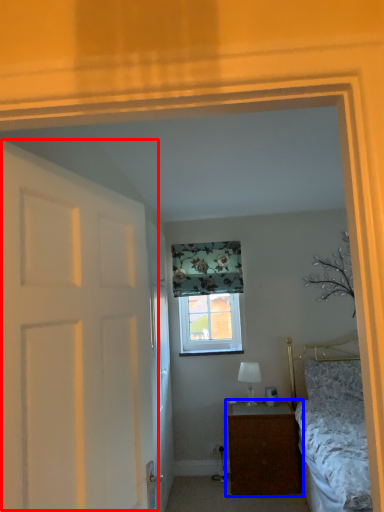
Question: Among these objects, which one is nearest to the camera, door (highlighted by a red box) or nightstand (highlighted by a blue box)?

Choices:
 (A) door
 (B) nightstand

Answer: (A)